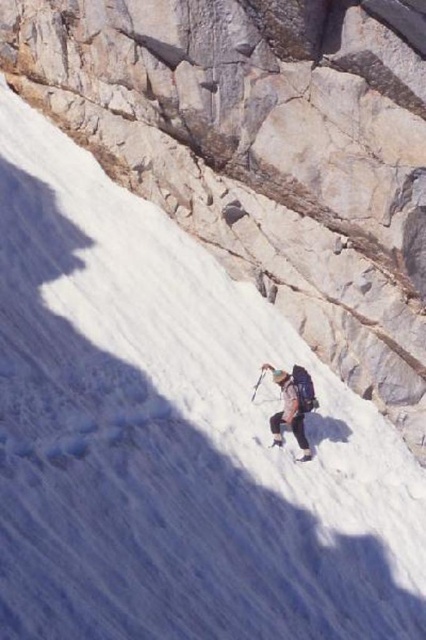
You are a photographer positioned at the bottom of the slope. You want to take a photo of the climber so that both the camouflage fabric jacket at center and the white plastic ski pole at center are clearly visible. Given their positions relative to each other, which object should you focus on first to ensure both are in sharp focus?

The camouflage fabric jacket at center is to the right of the white plastic ski pole at center. To ensure both are in sharp focus, you should focus on the white plastic ski pole at center first since it is closer to the photographer, and the camouflage fabric jacket at center will fall within the depth of field.

You are planning to place a 60 cm long tool horizontally between the camouflage fabric jacket at center and the white matte ski at center. Will the tool fit without overlapping either object?

The camouflage fabric jacket at center and white matte ski at center are 63.74 centimeters apart. Since the tool is 60 cm long, it will fit between them without overlapping either object as there is sufficient space.

You are planning to take a photo of the climber and their equipment. Given that the camouflage fabric jacket at center is larger than the white matte ski at center, which object would you focus on to ensure both are in the frame without needing to adjust the camera angle?

Since the camouflage fabric jacket at center is larger than the white matte ski at center, focusing on the camouflage fabric jacket at center would ensure both objects remain in the frame without adjusting the camera angle, as it occupies more space in the scene.